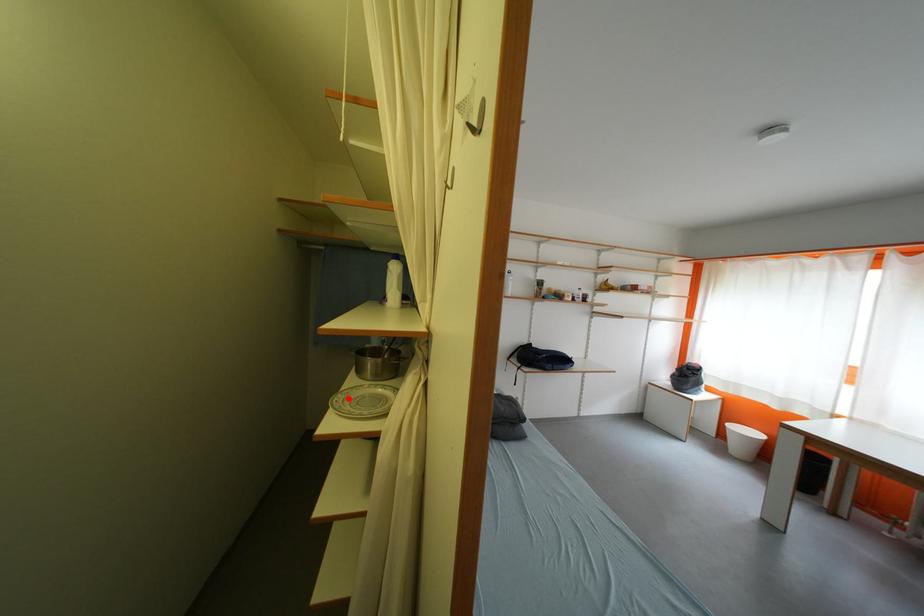
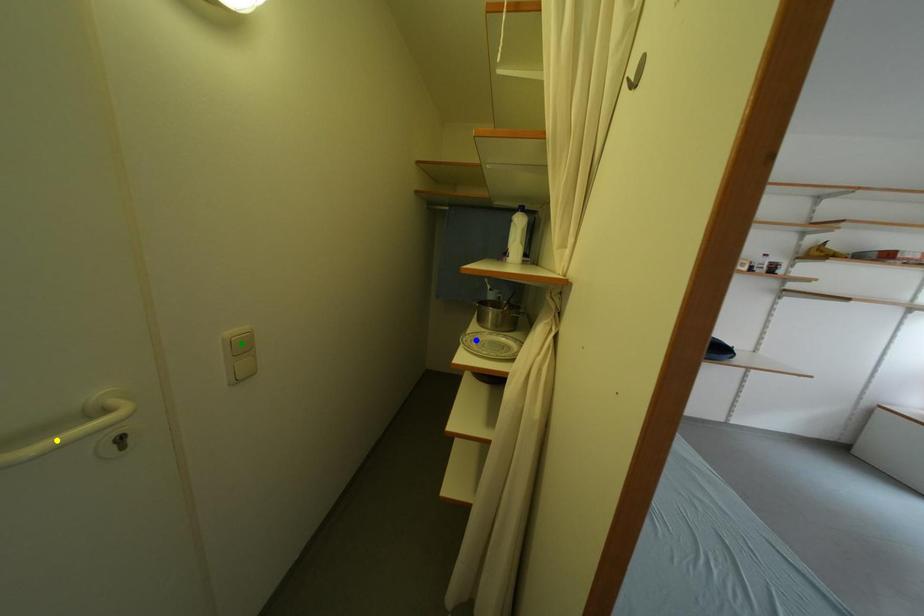
Question: I am providing you with two images of the same scene from different viewpoints. A red point is marked on the first image. You are given multiple points on the second image. Which spot in image 2 lines up with the point in image 1?

Choices:
 (A) green point
 (B) blue point
 (C) yellow point

Answer: (B)